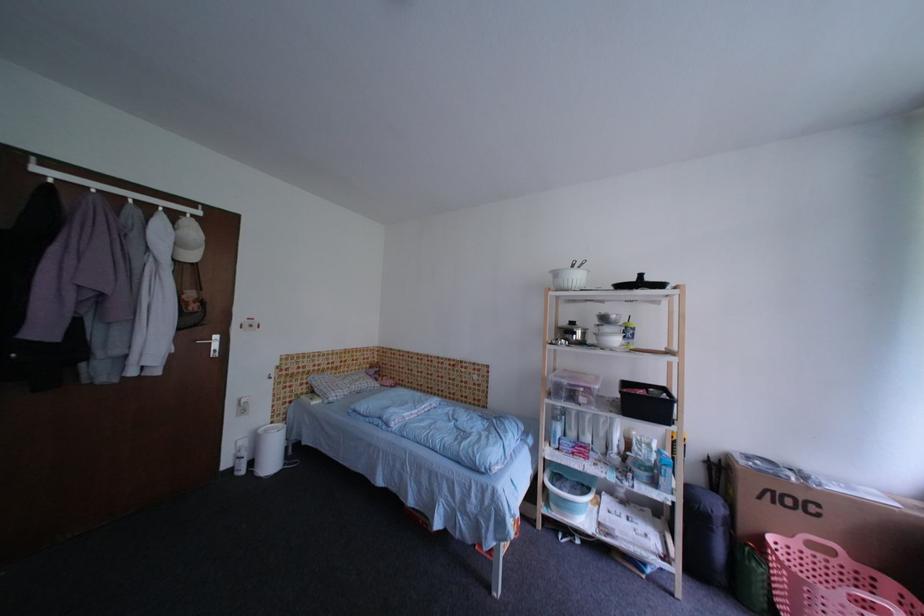
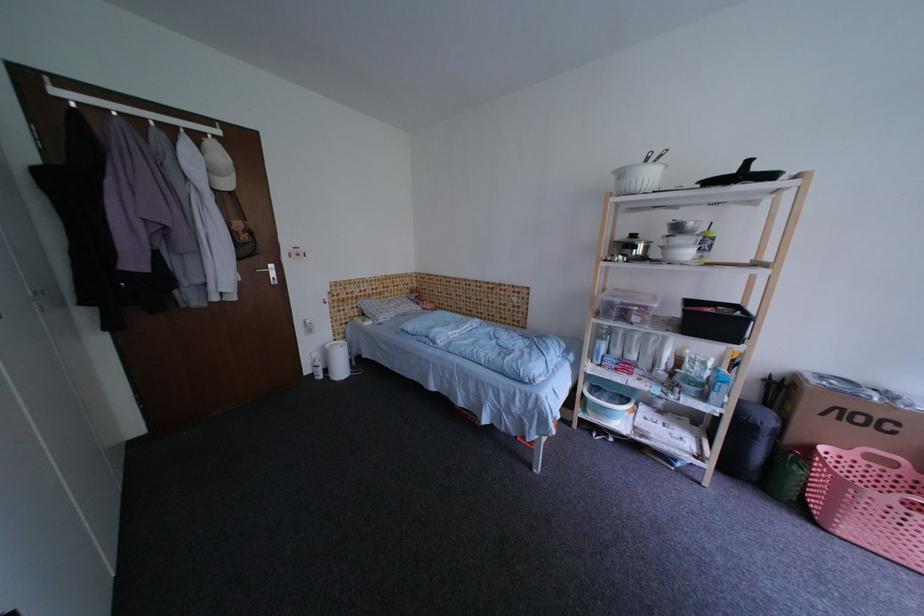
Where in the second image is the point corresponding to point (601, 331) from the first image?

(666, 245)